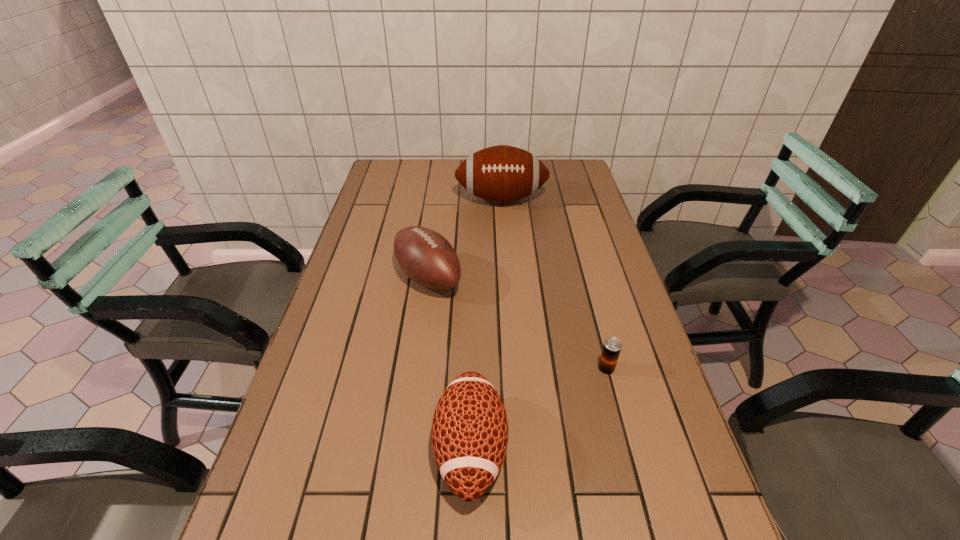
The image size is (960, 540). What are the coordinates of `the tallest object` in the screenshot? It's located at (502, 173).

Find the location of a particular element. The image size is (960, 540). the tallest football is located at coordinates (502, 173).

This screenshot has height=540, width=960. Identify the location of the second nearest football. (425, 256).

This screenshot has height=540, width=960. In order to click on the nearest object in this screenshot , I will do `click(469, 434)`.

Where is `the second nearest object`? the second nearest object is located at coordinates (612, 346).

Where is `the rightmost object`? The image size is (960, 540). the rightmost object is located at coordinates [x=612, y=346].

This screenshot has width=960, height=540. In order to click on free space located 0.280m on the laces of the tallest football in this screenshot , I will do `click(506, 266)`.

You are a GUI agent. You are given a task and a screenshot of the screen. Output one action in this format:
    pyautogui.click(x=<x>, y=<y>)
    Task: Click on the free space located 0.360m on the back of the second farthest football
    This screenshot has height=540, width=960.
    Given the screenshot: What is the action you would take?
    pyautogui.click(x=440, y=193)

Find the location of a particular element. The image size is (960, 540). blank space located on the back of the nearest football is located at coordinates (472, 357).

You are a GUI agent. You are given a task and a screenshot of the screen. Output one action in this format:
    pyautogui.click(x=<x>, y=<y>)
    Task: Click on the vacant space situated on the front of the second nearest object
    Image resolution: width=960 pixels, height=540 pixels.
    Given the screenshot: What is the action you would take?
    pyautogui.click(x=638, y=491)